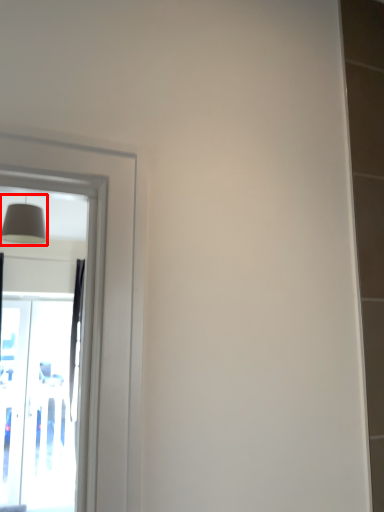
Question: Observing the image, what is the correct spatial positioning of lamp (annotated by the red box) in reference to screen door?

Choices:
 (A) right
 (B) left

Answer: (A)